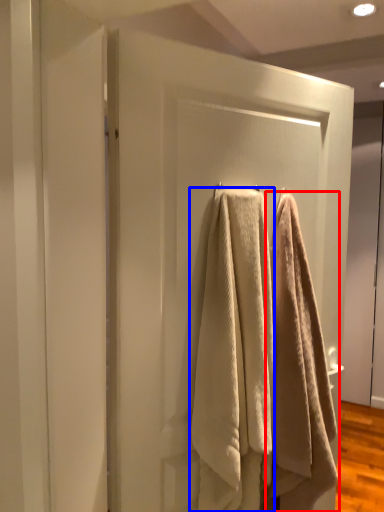
Question: Which object appears closest to the camera in this image, towel (highlighted by a red box) or towel (highlighted by a blue box)?

Choices:
 (A) towel
 (B) towel

Answer: (B)